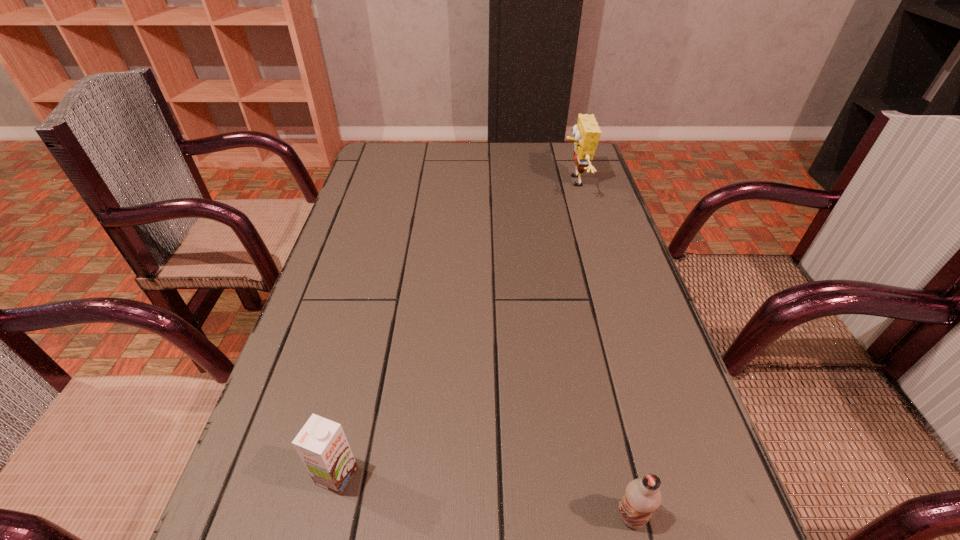
Find the location of `free space located 0.400m on the back of the nearest object`. free space located 0.400m on the back of the nearest object is located at coordinates (582, 305).

What are the coordinates of `object present at the far edge` in the screenshot? It's located at (586, 132).

This screenshot has width=960, height=540. In order to click on object that is at the left edge in this screenshot , I will do `click(321, 444)`.

Find the location of `sponge situated at the right edge`. sponge situated at the right edge is located at coordinates (586, 132).

At what (x,y) coordinates should I click in order to perform the action: click on chocolate milk that is at the right edge. Please return your answer as a coordinate pair (x, y). This screenshot has height=540, width=960. Looking at the image, I should click on (642, 497).

The image size is (960, 540). I want to click on object at the far right corner, so click(586, 132).

Locate an element on the screen. The image size is (960, 540). free space at the far edge is located at coordinates pyautogui.click(x=536, y=172).

The width and height of the screenshot is (960, 540). I want to click on free region at the left edge of the desktop, so click(287, 366).

Identify the location of free space at the far left corner of the desktop. The image size is (960, 540). 367,160.

Locate an element on the screen. Image resolution: width=960 pixels, height=540 pixels. vacant area at the far right corner is located at coordinates (572, 167).